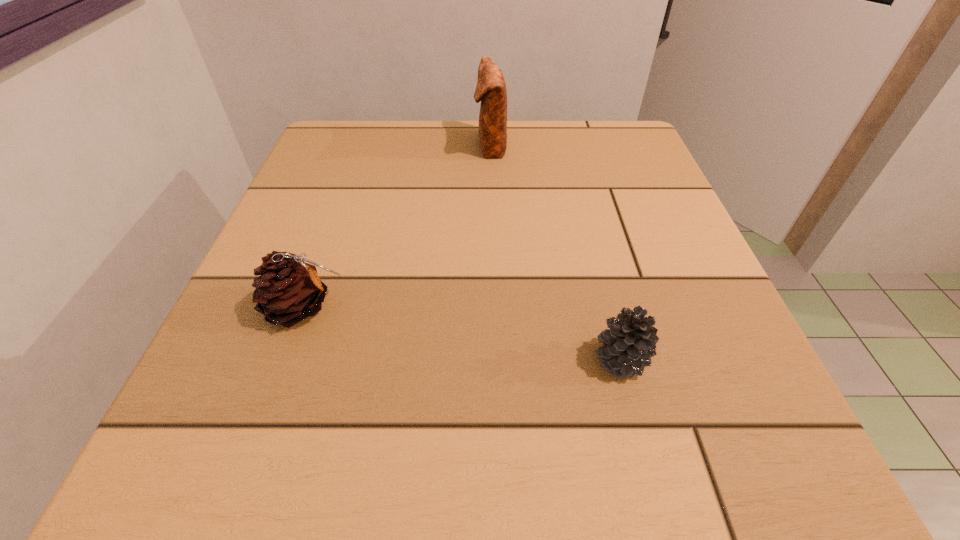
This screenshot has height=540, width=960. Identify the location of the tallest object. (491, 90).

The width and height of the screenshot is (960, 540). Identify the location of clutch bag. (491, 90).

This screenshot has width=960, height=540. I want to click on the left pinecone, so click(x=289, y=290).

Find the location of a particular element. The width and height of the screenshot is (960, 540). the second nearest object is located at coordinates (289, 290).

The width and height of the screenshot is (960, 540). I want to click on the nearest object, so click(x=629, y=344).

In order to click on the right pinecone in this screenshot , I will do `click(629, 344)`.

Where is `free space located 0.350m on the open side of the second object from right to left`? Image resolution: width=960 pixels, height=540 pixels. free space located 0.350m on the open side of the second object from right to left is located at coordinates (315, 146).

Locate an element on the screen. Image resolution: width=960 pixels, height=540 pixels. vacant region located on the open side of the second object from right to left is located at coordinates (396, 146).

Where is `blank space located on the open side of the second object from right to left`? The image size is (960, 540). blank space located on the open side of the second object from right to left is located at coordinates point(393,146).

Where is `free space located with a leaf charm attached to the left pinecone`? The width and height of the screenshot is (960, 540). free space located with a leaf charm attached to the left pinecone is located at coordinates (480, 307).